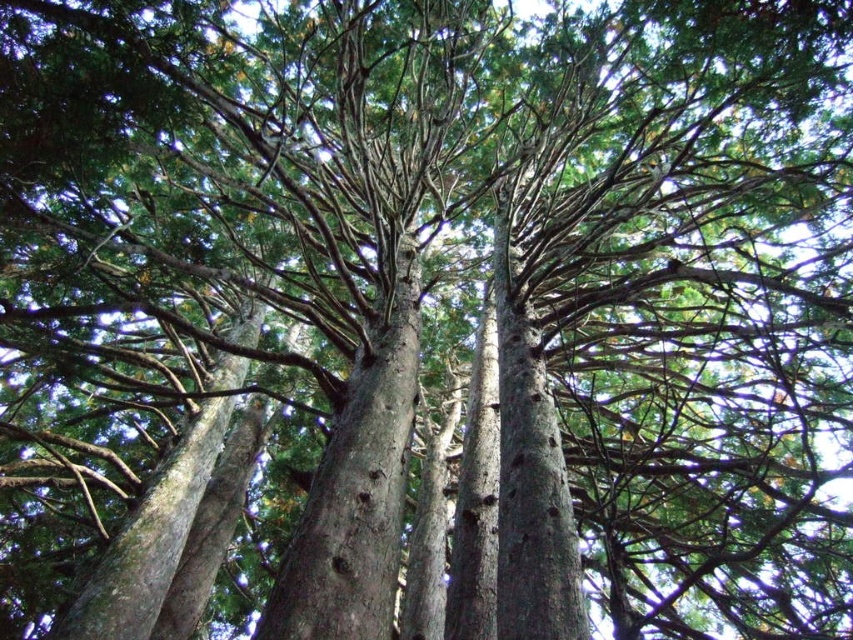
In the scene shown: Is smooth bark tree trunk at center positioned in front of smooth gray bark at center?

Yes, smooth bark tree trunk at center is in front of smooth gray bark at center.

Is smooth bark tree trunk at center wider than smooth gray bark at center?

No.

Locate an element on the screen. This screenshot has height=640, width=853. smooth bark tree trunk at center is located at coordinates (357, 486).

You are a GUI agent. You are given a task and a screenshot of the screen. Output one action in this format:
    pyautogui.click(x=<x>, y=<y>)
    Task: Click on the smooth bark tree trunk at center
    This screenshot has width=853, height=640.
    Given the screenshot: What is the action you would take?
    pyautogui.click(x=357, y=486)